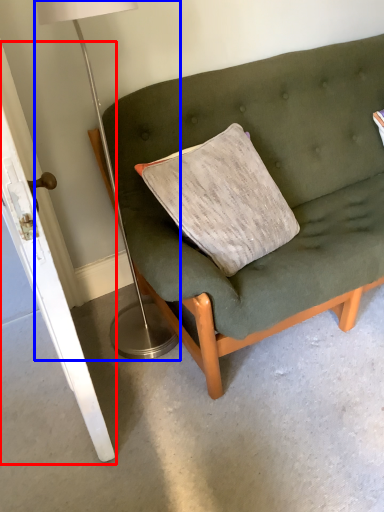
Question: Which point is closer to the camera, door (highlighted by a red box) or table lamp (highlighted by a blue box)?

Choices:
 (A) door
 (B) table lamp

Answer: (A)